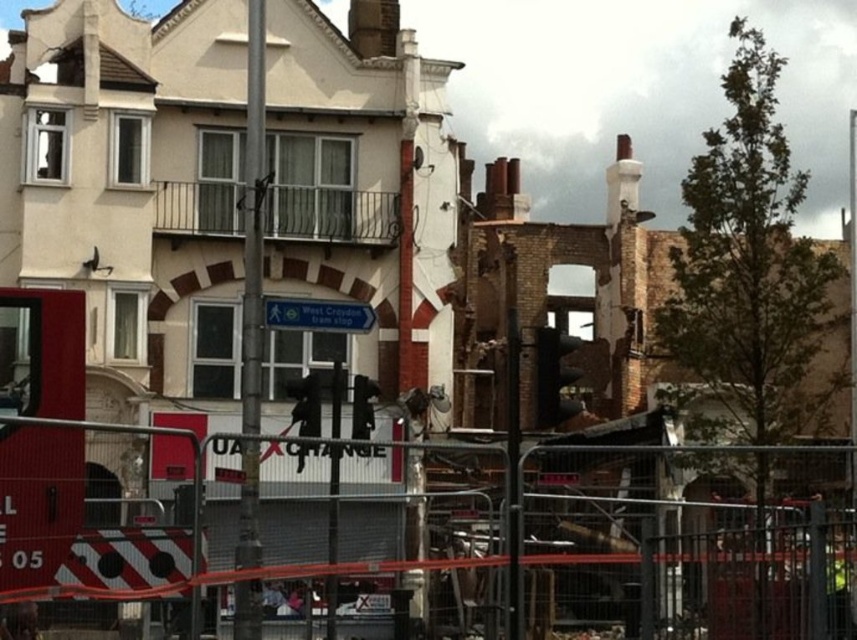
Question: Which point is closer to the camera?

Choices:
 (A) (310, 316)
 (B) (786, 616)
 (C) (259, 211)

Answer: (B)

Question: Which object appears closest to the camera in this image?

Choices:
 (A) metallic pole at center
 (B) blue plastic street sign at center

Answer: (A)

Question: Is metallic pole at center smaller than blue plastic street sign at center?

Choices:
 (A) yes
 (B) no

Answer: (B)

Question: Does metal fence at center come behind metallic pole at center?

Choices:
 (A) no
 (B) yes

Answer: (A)

Question: Can you confirm if metal fence at center is positioned above metallic pole at center?

Choices:
 (A) no
 (B) yes

Answer: (A)

Question: Based on their relative distances, which object is nearer to the metal fence at center?

Choices:
 (A) metallic pole at center
 (B) blue plastic street sign at center

Answer: (B)